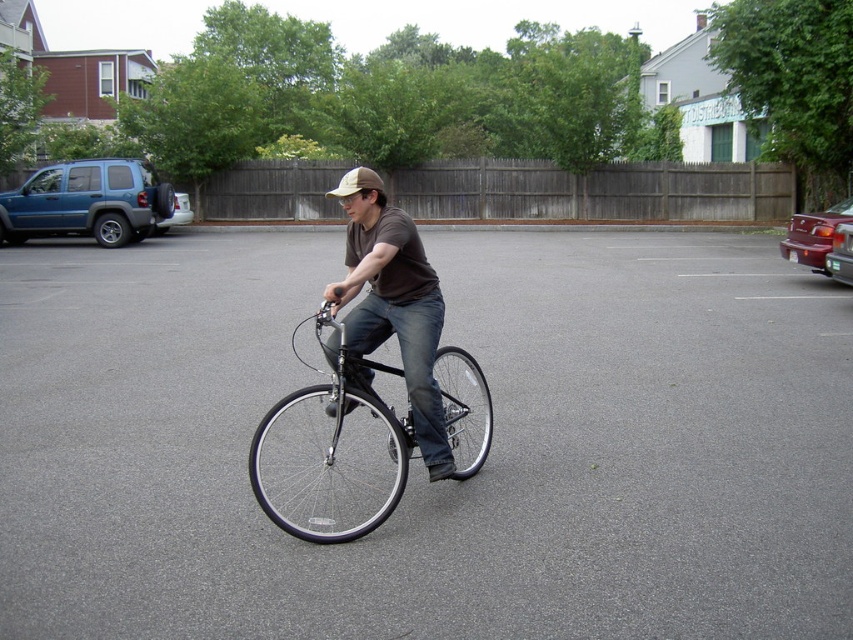
Between shiny black bicycle at center and matte blue suv at left, which one is positioned higher?

matte blue suv at left is higher up.

From the picture: Who is lower down, shiny black bicycle at center or matte blue suv at left?

shiny black bicycle at center

Describe the element at coordinates (331, 461) in the screenshot. This screenshot has width=853, height=640. I see `shiny black bicycle at center` at that location.

This screenshot has width=853, height=640. In order to click on shiny black bicycle at center in this screenshot , I will do `click(331, 461)`.

From the picture: Who is positioned more to the left, matte brown shirt at center or brown fabric baseball hat at center?

brown fabric baseball hat at center is more to the left.

Between matte brown shirt at center and brown fabric baseball hat at center, which one has more height?

brown fabric baseball hat at center is taller.

Who is more forward, (374, 244) or (358, 182)?

Point (374, 244)

This screenshot has width=853, height=640. I want to click on matte brown shirt at center, so click(395, 310).

Is gray asphalt parking lot at center below brown fabric baseball hat at center?

Yes, gray asphalt parking lot at center is below brown fabric baseball hat at center.

Which is below, gray asphalt parking lot at center or brown fabric baseball hat at center?

gray asphalt parking lot at center is lower down.

Between point (676, 244) and point (334, 196), which one is positioned behind?

The point (334, 196) is behind.

Where is `gray asphalt parking lot at center`? This screenshot has width=853, height=640. gray asphalt parking lot at center is located at coordinates (421, 461).